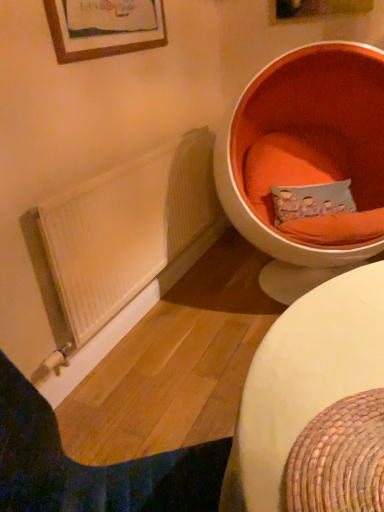
Question: Looking at their shapes, would you say white woven table at lower right is wider or thinner than orange fabric pillow at upper right?

Choices:
 (A) thin
 (B) wide

Answer: (B)

Question: Is white woven table at lower right situated inside orange fabric pillow at upper right or outside?

Choices:
 (A) outside
 (B) inside

Answer: (A)

Question: Estimate the real-world distances between objects in this image. Which object is closer to the orange fabric pillow at upper right?

Choices:
 (A) white wood radiator at lower left
 (B) orange fabric at right
 (C) white woven table at lower right

Answer: (B)

Question: Which object is positioned farthest from the white wood radiator at lower left?

Choices:
 (A) white woven table at lower right
 (B) orange fabric pillow at upper right
 (C) orange fabric at right

Answer: (B)